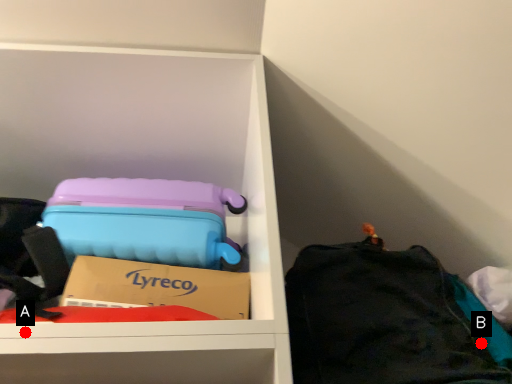
Question: Two points are circled on the image, labeled by A and B beside each circle. Which point is closer to the camera?

Choices:
 (A) A is closer
 (B) B is closer

Answer: (A)